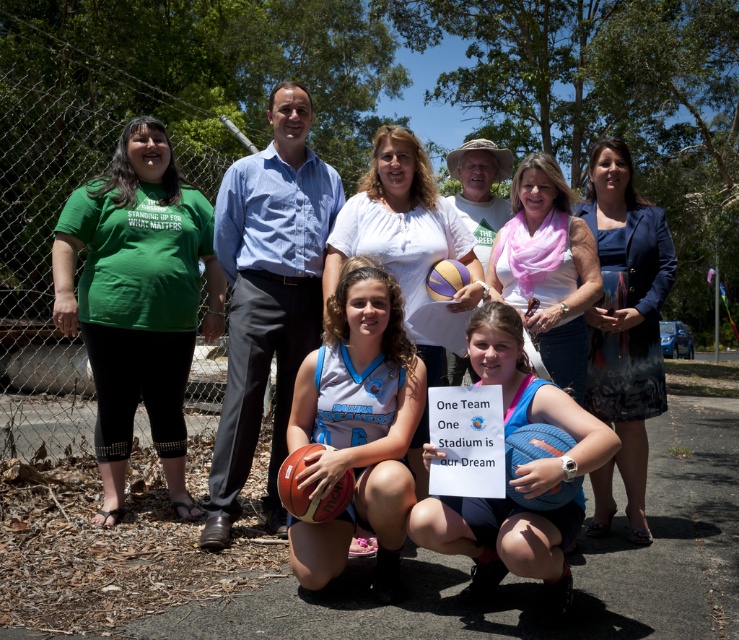
Question: Among these objects, which one is nearest to the camera?

Choices:
 (A) blue jersey basketball at center
 (B) yellow matte basketball at center

Answer: (A)

Question: Can you confirm if blue jersey basketball at center is positioned below white cotton shirt at center?

Choices:
 (A) no
 (B) yes

Answer: (B)

Question: Which point is farther from the camera taking this photo?

Choices:
 (A) pos(582,333)
 (B) pos(452,259)

Answer: (B)

Question: Which point is closer to the camera?

Choices:
 (A) (129, 422)
 (B) (336, 500)
 (C) (367, 220)
 (D) (511, 477)

Answer: (D)

Question: Does rubber textured basketball at lower center have a greater width compared to yellow matte basketball at center?

Choices:
 (A) yes
 (B) no

Answer: (A)

Question: Is blue fabric sign at center above yellow matte basketball at center?

Choices:
 (A) no
 (B) yes

Answer: (A)